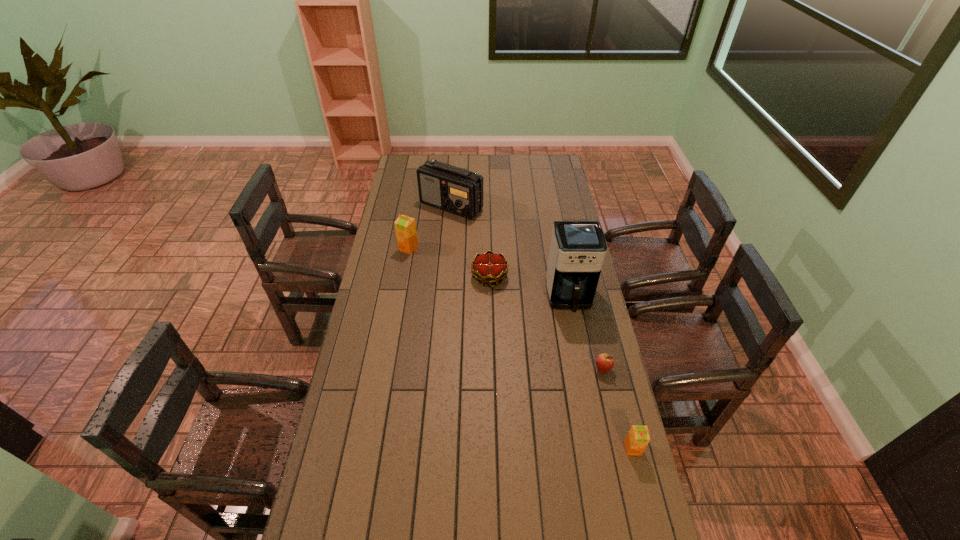
In order to click on vacant space located on the left of the third shortest object in this screenshot , I will do `click(556, 448)`.

Locate an element on the screen. free space located on the front panel of the farthest object is located at coordinates (449, 232).

This screenshot has height=540, width=960. What are the coordinates of `vacant space located 0.200m on the front panel of the tallest object` in the screenshot? It's located at (582, 362).

This screenshot has width=960, height=540. Identify the location of free space located 0.310m on the left of the crown. (397, 276).

What are the coordinates of `vacant position located on the left of the apple` in the screenshot? It's located at (579, 369).

Where is `orange juice located at the left edge`? The height and width of the screenshot is (540, 960). orange juice located at the left edge is located at coordinates (405, 227).

In order to click on radio receiver that is at the left edge in this screenshot , I will do `click(456, 190)`.

The width and height of the screenshot is (960, 540). I want to click on orange juice that is at the right edge, so click(x=638, y=437).

Locate an element on the screen. The height and width of the screenshot is (540, 960). coffee maker at the right edge is located at coordinates (577, 250).

Identify the location of apple present at the right edge. This screenshot has width=960, height=540. (604, 362).